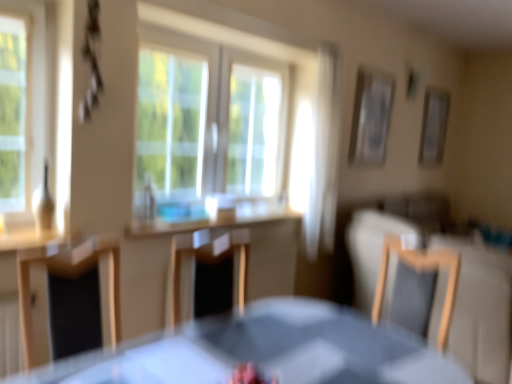
Locate an element on the screen. The width and height of the screenshot is (512, 384). smooth gray table at center is located at coordinates (263, 351).

Locate an element on the screen. This screenshot has height=384, width=512. light brown wooden chair at right, acting as the second chair starting from the left is located at coordinates (417, 287).

Where is `wooden picture frame at upper right, which is the 1th picture frame in right-to-left order`? wooden picture frame at upper right, which is the 1th picture frame in right-to-left order is located at coordinates (434, 126).

Locate an element on the screen. The height and width of the screenshot is (384, 512). clear glass window at center is located at coordinates (211, 120).

Locate an element on the screen. The height and width of the screenshot is (384, 512). smooth gray table at center is located at coordinates (263, 351).

Which object is closer to the camera taking this photo, light brown wooden chair at right, the 1th chair in the right-to-left sequence, or wooden chair at center, the 2th chair in the right-to-left sequence?

wooden chair at center, the 2th chair in the right-to-left sequence, is in front.

What's the angular difference between light brown wooden chair at right, acting as the second chair starting from the left, and wooden chair at center, the 2th chair in the right-to-left sequence,'s facing directions?

88.2 degrees.

From a real-world perspective, which object stands above the other?

light brown wooden chair at right, acting as the second chair starting from the left, from a real-world perspective.

Is white sheer curtain at upper center wider than white glossy counter top at center?

No.

Identify the location of counter top below the white sheer curtain at upper center (from a real-world perspective). The image size is (512, 384). (217, 220).

Is white sheer curtain at upper center not within white glossy counter top at center?

Absolutely, white sheer curtain at upper center is external to white glossy counter top at center.

From the picture: Considering the sizes of objects white glossy counter top at center and clear glass window at center in the image provided, who is smaller, white glossy counter top at center or clear glass window at center?

white glossy counter top at center.

Would you say clear glass window at center is part of white glossy counter top at center's contents?

No, white glossy counter top at center does not contain clear glass window at center.

Does white glossy counter top at center turn towards clear glass window at center?

No, white glossy counter top at center is not oriented towards clear glass window at center.

Looking at their sizes, would you say metallic silver picture frame at upper right, the first picture frame when ordered from left to right, is wider or thinner than white sheer curtain at upper center?

Clearly, metallic silver picture frame at upper right, the first picture frame when ordered from left to right, has less width compared to white sheer curtain at upper center.

Between metallic silver picture frame at upper right, which appears as the first picture frame when viewed from the front, and white sheer curtain at upper center, which one has smaller size?

metallic silver picture frame at upper right, which appears as the first picture frame when viewed from the front.

Considering the relative positions of metallic silver picture frame at upper right, arranged as the 2th picture frame when viewed from the right, and white sheer curtain at upper center in the image provided, is metallic silver picture frame at upper right, arranged as the 2th picture frame when viewed from the right, to the right of white sheer curtain at upper center from the viewer's perspective?

Yes, metallic silver picture frame at upper right, arranged as the 2th picture frame when viewed from the right, is to the right of white sheer curtain at upper center.

From a real-world perspective, is metallic silver picture frame at upper right, which is the second picture frame in back-to-front order, beneath white sheer curtain at upper center?

No, from a real-world perspective, metallic silver picture frame at upper right, which is the second picture frame in back-to-front order, is not below white sheer curtain at upper center.

From the image's perspective, is wooden picture frame at upper right, the 2th picture frame when ordered from front to back, on clear glass window at center?

Yes, from the image's perspective, wooden picture frame at upper right, the 2th picture frame when ordered from front to back, is above clear glass window at center.

Locate an element on the screen. The width and height of the screenshot is (512, 384). the 2nd picture frame behind when counting from the clear glass window at center is located at coordinates (434, 126).

Is wooden picture frame at upper right, the 2th picture frame when ordered from front to back, next to clear glass window at center and touching it?

There is a gap between wooden picture frame at upper right, the 2th picture frame when ordered from front to back, and clear glass window at center.

Looking at this image, does wooden picture frame at upper right, arranged as the first picture frame when viewed from the back, have a smaller size compared to clear glass window at center?

Correct, wooden picture frame at upper right, arranged as the first picture frame when viewed from the back, occupies less space than clear glass window at center.

Which object is positioned more to the right, metallic silver picture frame at upper right, arranged as the 2th picture frame when viewed from the right, or clear glass window at center?

metallic silver picture frame at upper right, arranged as the 2th picture frame when viewed from the right, is more to the right.

Is metallic silver picture frame at upper right, arranged as the 2th picture frame when viewed from the right, wider or thinner than clear glass window at center?

Clearly, metallic silver picture frame at upper right, arranged as the 2th picture frame when viewed from the right, has less width compared to clear glass window at center.

Is metallic silver picture frame at upper right, which is the second picture frame in back-to-front order, positioned far away from clear glass window at center?

Yes.

From a real-world perspective, is metallic silver picture frame at upper right, the first picture frame when ordered from left to right, physically below wooden chair at center, the 2th chair in the right-to-left sequence?

No, from a real-world perspective, metallic silver picture frame at upper right, the first picture frame when ordered from left to right, is not under wooden chair at center, the 2th chair in the right-to-left sequence.

Is point (384, 111) in front of point (82, 259)?

No.

Is metallic silver picture frame at upper right, the first picture frame when ordered from left to right, next to wooden chair at center, the first chair from the left, and touching it?

They are not placed beside each other.

How many degrees apart are the facing directions of metallic silver picture frame at upper right, which is the second picture frame in back-to-front order, and wooden chair at center, the first chair from the left?

They differ by 4.27 degrees in their facing directions.

Identify the location of chair above the wooden chair at center, the 2th chair in the right-to-left sequence (from the image's perspective). (417, 287).

Identify the location of counter top on the left of white sheer curtain at upper center. The width and height of the screenshot is (512, 384). (217, 220).

Looking at the image, which one is located closer to clear glass window at center, white glossy counter top at center or white sheer curtain at upper center?

Among the two, white glossy counter top at center is located nearer to clear glass window at center.

Considering their positions, is smooth gray table at center positioned further to wooden picture frame at upper right, which is the 1th picture frame in right-to-left order, than wooden chair at center, the 2th chair in the right-to-left sequence?

Based on the image, wooden chair at center, the 2th chair in the right-to-left sequence, appears to be further to wooden picture frame at upper right, which is the 1th picture frame in right-to-left order.

Based on their spatial positions, is wooden chair at center, the 2th chair in the right-to-left sequence, or white glossy counter top at center further from light brown wooden chair at right, the 1th chair in the right-to-left sequence?

Among the two, wooden chair at center, the 2th chair in the right-to-left sequence, is located further to light brown wooden chair at right, the 1th chair in the right-to-left sequence.

Estimate the real-world distances between objects in this image. Which object is closer to light brown wooden chair at right, acting as the second chair starting from the left, white glossy counter top at center or clear glass window at center?

white glossy counter top at center.

When comparing their distances from wooden chair at center, the first chair from the left, does clear glass window at center or metallic silver picture frame at upper right, the first picture frame when ordered from left to right, seem further?

metallic silver picture frame at upper right, the first picture frame when ordered from left to right, is further to wooden chair at center, the first chair from the left.

Which object lies further to the anchor point wooden chair at center, the first chair from the left, smooth gray table at center or clear glass window at center?

clear glass window at center is positioned further to the anchor wooden chair at center, the first chair from the left.

When comparing their distances from wooden chair at center, the 2th chair in the right-to-left sequence, does metallic silver picture frame at upper right, arranged as the 2th picture frame when viewed from the right, or light brown wooden chair at right, acting as the second chair starting from the left, seem further?

metallic silver picture frame at upper right, arranged as the 2th picture frame when viewed from the right.

From the image, which object appears to be nearer to clear glass window at center, wooden picture frame at upper right, which is the 1th picture frame in right-to-left order, or smooth gray table at center?

smooth gray table at center lies closer to clear glass window at center than the other object.

Locate an element on the screen. Image resolution: width=512 pixels, height=384 pixels. curtain between smooth gray table at center and metallic silver picture frame at upper right, which is the second picture frame in back-to-front order, along the z-axis is located at coordinates (324, 153).

Where is `chair between wooden chair at center, the first chair from the left, and clear glass window at center in the front-back direction`? The height and width of the screenshot is (384, 512). chair between wooden chair at center, the first chair from the left, and clear glass window at center in the front-back direction is located at coordinates (417, 287).

Identify the location of counter top between wooden chair at center, the 2th chair in the right-to-left sequence, and metallic silver picture frame at upper right, arranged as the 2th picture frame when viewed from the right, in the front-back direction. (217, 220).

The width and height of the screenshot is (512, 384). I want to click on chair positioned between wooden chair at center, the 2th chair in the right-to-left sequence, and white glossy counter top at center from near to far, so click(x=417, y=287).